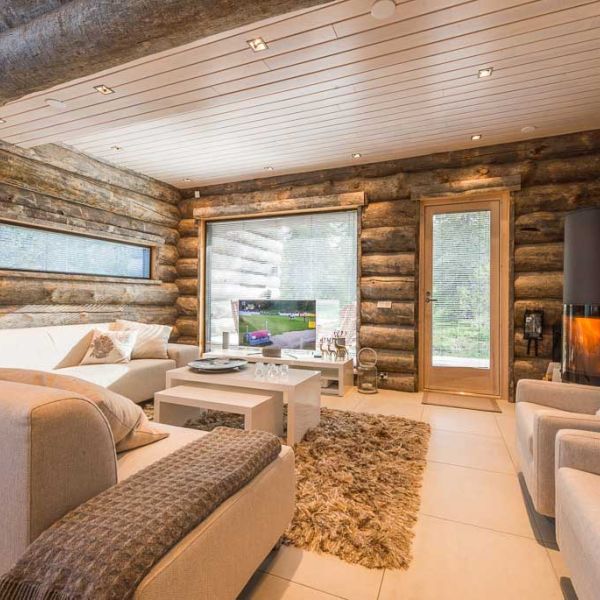
Locate an element on the screen. This screenshot has height=600, width=600. 3 windows is located at coordinates (116, 259), (320, 247), (457, 269).